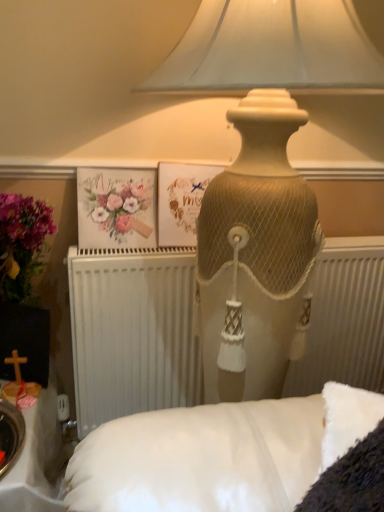
Question: Is watercolor paper flowers at upper left facing away from white textured radiator at center?

Choices:
 (A) yes
 (B) no

Answer: (B)

Question: Is watercolor paper flowers at upper left located outside white textured radiator at center?

Choices:
 (A) yes
 (B) no

Answer: (A)

Question: Is watercolor paper flowers at upper left shorter than white textured radiator at center?

Choices:
 (A) yes
 (B) no

Answer: (A)

Question: From a real-world perspective, does watercolor paper flowers at upper left stand above white textured radiator at center?

Choices:
 (A) yes
 (B) no

Answer: (A)

Question: Can you confirm if watercolor paper flowers at upper left is taller than white textured radiator at center?

Choices:
 (A) no
 (B) yes

Answer: (A)

Question: Is matte beige lamp at upper center situated inside matte paper postcard at center or outside?

Choices:
 (A) inside
 (B) outside

Answer: (B)

Question: Would you say matte beige lamp at upper center is to the left or to the right of matte paper postcard at center in the picture?

Choices:
 (A) right
 (B) left

Answer: (A)

Question: Looking at the image, does matte beige lamp at upper center seem bigger or smaller compared to matte paper postcard at center?

Choices:
 (A) big
 (B) small

Answer: (A)

Question: From the image's perspective, is matte beige lamp at upper center located above or below matte paper postcard at center?

Choices:
 (A) below
 (B) above

Answer: (A)

Question: In terms of size, does watercolor paper flowers at upper left appear bigger or smaller than white textured radiator at center?

Choices:
 (A) big
 (B) small

Answer: (B)

Question: Considering the relative positions of watercolor paper flowers at upper left and white textured radiator at center in the image provided, is watercolor paper flowers at upper left to the left or to the right of white textured radiator at center?

Choices:
 (A) right
 (B) left

Answer: (B)

Question: Is watercolor paper flowers at upper left inside the boundaries of white textured radiator at center, or outside?

Choices:
 (A) inside
 (B) outside

Answer: (B)

Question: From the image's perspective, is watercolor paper flowers at upper left positioned above or below white textured radiator at center?

Choices:
 (A) above
 (B) below

Answer: (A)

Question: Would you say white textured radiator at center is inside or outside matte beige lamp at upper center?

Choices:
 (A) inside
 (B) outside

Answer: (A)

Question: From a real-world perspective, is white textured radiator at center physically located above or below matte beige lamp at upper center?

Choices:
 (A) below
 (B) above

Answer: (A)